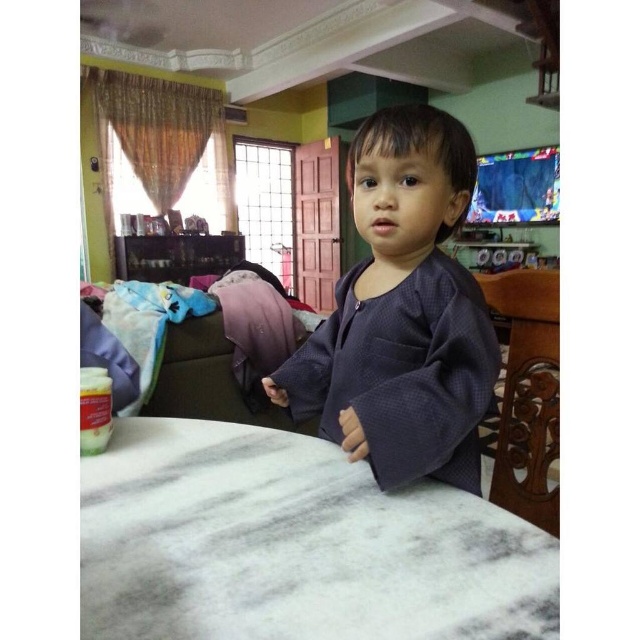
You are a photographer standing in front of the white marble table at center. You want to position your camera so that it is exactly 20 inches away from the table. Based on the scene description, is your current position too close or too far from the table?

The white marble table at center and camera are currently 18.66 inches apart. Since 18.66 inches is less than 20 inches, you are too close to the table and need to move back approximately 1.34 inches to achieve the desired distance.

You are a guest entering the room and want to sit down. There is a dark grey textured robe at center and a carved wood chair at right. Which object is closer to the door?

The carved wood chair at right is closer to the door because the dark grey textured robe at center is to the left of it, meaning the chair is positioned further right near the door.

You are a guest in this home and want to sit down on the carved wood chair at right. However, you notice the dark grey textured robe at center is placed in the middle of the room. Do you think the robe is wider than the chair?

The dark grey textured robe at center is wider than the carved wood chair at right, so yes, the robe is wider than the chair.